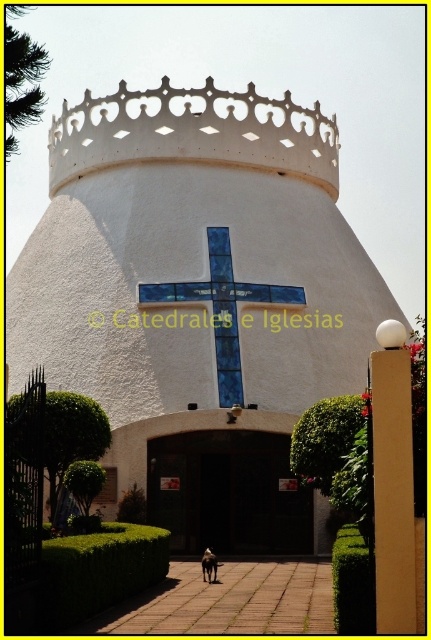
Is point (216, 244) in front of point (202, 477)?

No, it is not.

Does white textured dome at center lie in front of dark brown wooden door at center?

Yes, white textured dome at center is in front of dark brown wooden door at center.

The height and width of the screenshot is (640, 431). What do you see at coordinates (196, 289) in the screenshot?
I see `white textured dome at center` at bounding box center [196, 289].

Identify the location of white textured dome at center. Image resolution: width=431 pixels, height=640 pixels. (196, 289).

Who is lower down, white textured crown at upper center or dark brown wooden door at center?

Positioned lower is dark brown wooden door at center.

Who is more forward, (137, 100) or (224, 502)?

Point (224, 502) is more forward.

Image resolution: width=431 pixels, height=640 pixels. Identify the location of white textured crown at upper center. (193, 132).

Which is above, dark brown wooden door at center or blue glass cross at center?

Positioned higher is blue glass cross at center.

Is point (165, 474) closer to viewer compared to point (225, 285)?

Yes.

The width and height of the screenshot is (431, 640). Describe the element at coordinates (227, 493) in the screenshot. I see `dark brown wooden door at center` at that location.

I want to click on dark brown wooden door at center, so click(x=227, y=493).